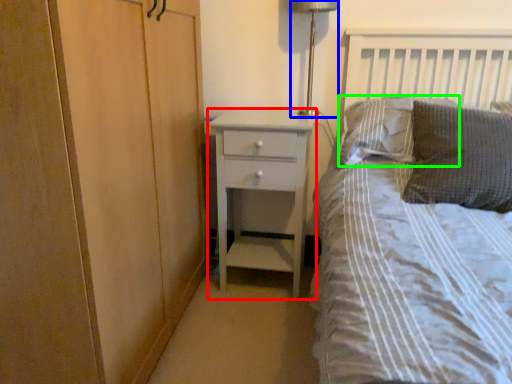
Question: Considering the real-world distances, which object is farthest from chest of drawers (highlighted by a red box)? bedside lamp (highlighted by a blue box) or pillow (highlighted by a green box)?

Choices:
 (A) bedside lamp
 (B) pillow

Answer: (A)